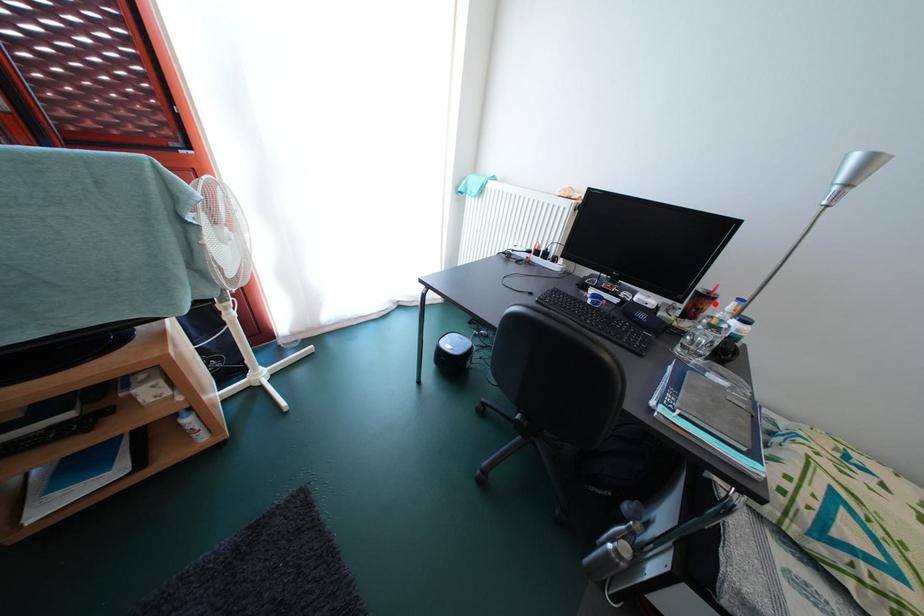
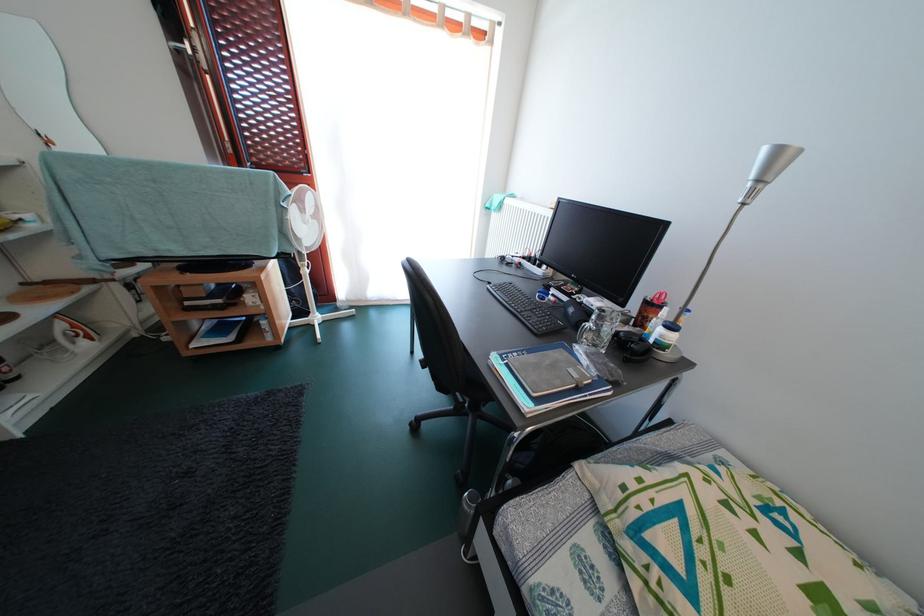
In the second image, find the point that corresponds to the highlighted location in the first image.

(658, 310)